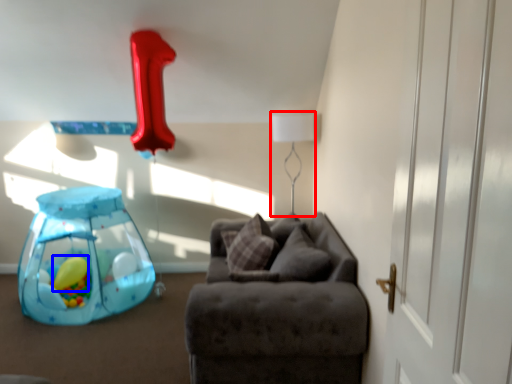
Question: Which object appears closest to the camera in this image, table lamp (highlighted by a red box) or balloon (highlighted by a blue box)?

Choices:
 (A) table lamp
 (B) balloon

Answer: (A)